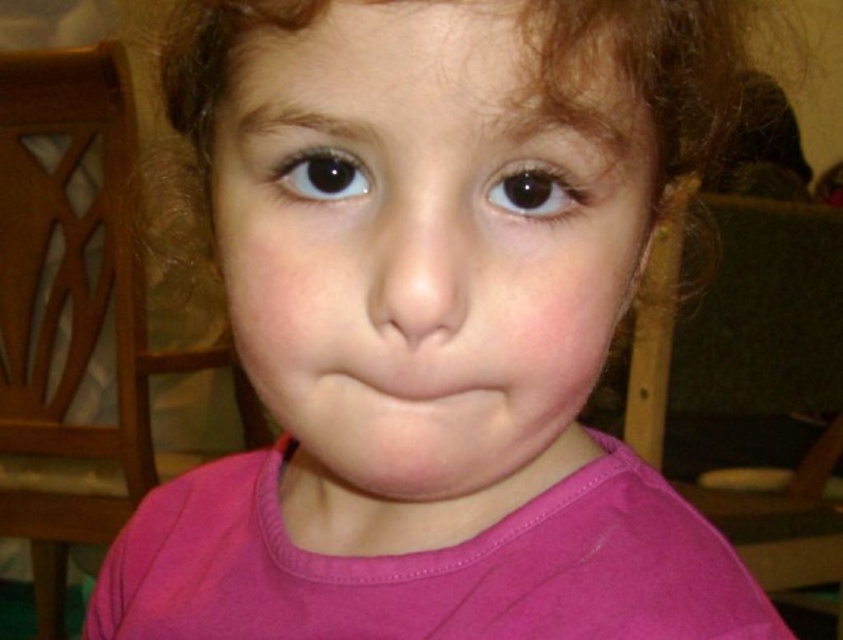
You are a photographer setting up for a close portrait. You need to ensure that the subject, the curly brown hair at center, is within the optimal focus range of your lens, which is 15 inches. Will the current distance of 15.15 inches allow for sharp focus?

The distance of curly brown hair at center from the camera is 15.15 inches, which is just slightly beyond the lens optimal focus range of 15 inches. This might result in a slight softness in focus unless adjusted.

You are a photographer adjusting the lighting for a portrait. You notice the curly brown hair at center and the brown shiny eye at center. Which object is positioned higher in the frame?

The curly brown hair at center is located above the brown shiny eye at center, so it is positioned higher in the frame.

You are a photographer trying to capture the child in the image. If you want to focus on the brown shiny eye at center without the curly brown hair at center blocking it, what adjustment should you make to your camera angle?

To focus on the brown shiny eye at center without the curly brown hair at center blocking it, you should adjust the camera angle to move slightly above the curly brown hair at center so that the brown shiny eye at center becomes visible. Since the brown shiny eye at center is behind the curly brown hair at center, tilting the camera upward might help reveal the eye by shifting the perspective.